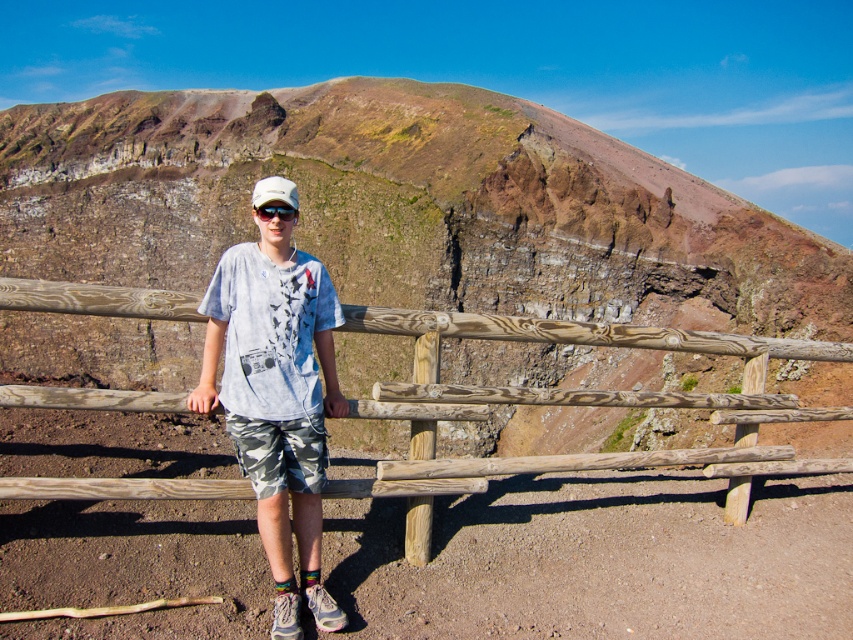
Question: Is brown rocky mountain at center further to camera compared to white cotton shirt at center?

Choices:
 (A) no
 (B) yes

Answer: (B)

Question: Which object is closer to the camera taking this photo?

Choices:
 (A) wooden fence at center
 (B) white cotton shirt at center
 (C) brown rocky mountain at center

Answer: (B)

Question: Estimate the real-world distances between objects in this image. Which object is farther from the brown rocky mountain at center?

Choices:
 (A) white matte baseball hat at center
 (B) wooden fence at center

Answer: (B)

Question: Is the position of white cotton shirt at center less distant than that of black plastic goggles at center?

Choices:
 (A) no
 (B) yes

Answer: (B)

Question: Considering the relative positions of brown rocky mountain at center and white cotton shirt at center in the image provided, where is brown rocky mountain at center located with respect to white cotton shirt at center?

Choices:
 (A) above
 (B) below

Answer: (A)

Question: Which is farther from the white cotton shirt at center?

Choices:
 (A) black plastic goggles at center
 (B) brown rocky mountain at center
 (C) wooden fence at center
 (D) white matte baseball hat at center

Answer: (B)